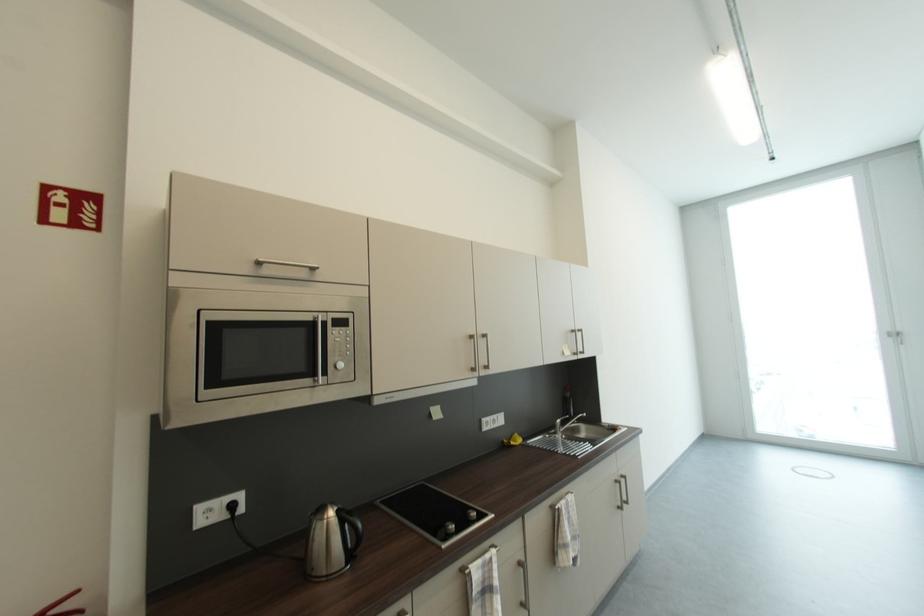
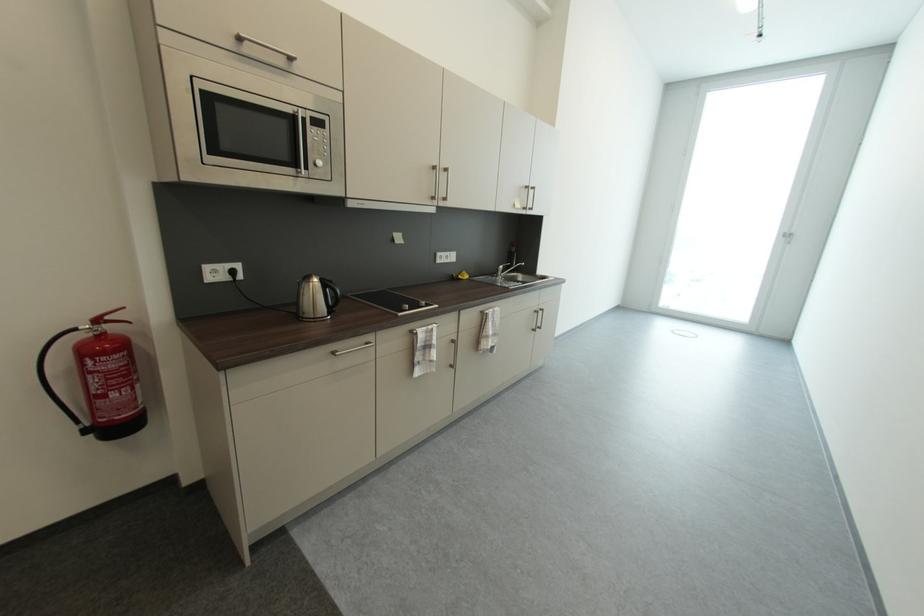
Where in the second image is the point corresponding to pixel 343 369 from the first image?

(322, 166)